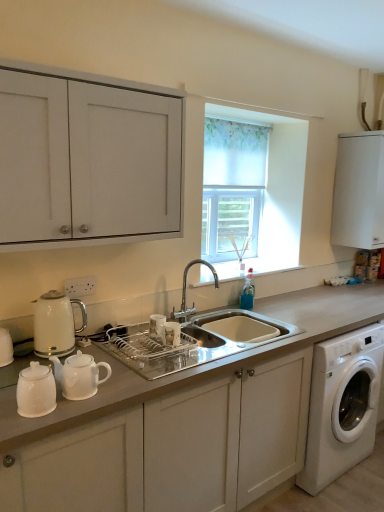
What do you see at coordinates (79, 375) in the screenshot? I see `white glossy teapot at lower left` at bounding box center [79, 375].

Find the location of a particular element. The width and height of the screenshot is (384, 512). blue translucent soap dispenser at sink right is located at coordinates (248, 292).

What do you see at coordinates (359, 191) in the screenshot? The height and width of the screenshot is (512, 384). I see `white matte cabinet at upper right, arranged as the third cabinetry when viewed from the left` at bounding box center [359, 191].

Describe the element at coordinates (87, 159) in the screenshot. I see `white matte cabinet at upper left, which appears as the second cabinetry when ordered from the bottom` at that location.

Describe the element at coordinates (173, 448) in the screenshot. I see `white matte cabinet at center, placed as the 2th cabinetry when sorted from left to right` at that location.

Where is `white glossy teapot at lower left`? white glossy teapot at lower left is located at coordinates (79, 375).

The height and width of the screenshot is (512, 384). What are the coordinates of `cabinetry on the right side of blue translucent soap dispenser at sink right` in the screenshot? It's located at pos(359,191).

Between blue translucent soap dispenser at sink right and white matte cabinet at upper right, which ranks as the first cabinetry in right-to-left order, which one appears on the right side from the viewer's perspective?

Positioned to the right is white matte cabinet at upper right, which ranks as the first cabinetry in right-to-left order.

Looking at the image, does blue translucent soap dispenser at sink right seem bigger or smaller compared to white matte cabinet at upper right, arranged as the third cabinetry when viewed from the left?

In the image, blue translucent soap dispenser at sink right appears to be smaller than white matte cabinet at upper right, arranged as the third cabinetry when viewed from the left.

From the image's perspective, is translucent fabric at center beneath white matte cabinet at center, which appears as the 1th cabinetry when ordered from the bottom?

No.

How different are the orientations of translucent fabric at center and white matte cabinet at center, placed as the third cabinetry when sorted from top to bottom, in degrees?

The angle between the facing direction of translucent fabric at center and the facing direction of white matte cabinet at center, placed as the third cabinetry when sorted from top to bottom, is 0.223 degrees.

Relative to white matte cabinet at center, placed as the third cabinetry when sorted from top to bottom, is translucent fabric at center in front or behind?

Visually, translucent fabric at center is located behind white matte cabinet at center, placed as the third cabinetry when sorted from top to bottom.

Which of these two, polished chrome faucet at center or clear plastic dish at center, is thinner?

Thinner between the two is clear plastic dish at center.

You are a GUI agent. You are given a task and a screenshot of the screen. Output one action in this format:
    pyautogui.click(x=<x>, y=<y>)
    Task: Click on the appliance in front of the polished chrome faucet at center
    This screenshot has width=384, height=512.
    Given the screenshot: What is the action you would take?
    pyautogui.click(x=157, y=325)

Is clear plastic dish at center at the back of polished chrome faucet at center?

polished chrome faucet at center is not turned away from clear plastic dish at center.

Which of these two, polished chrome faucet at center or clear plastic dish at center, is bigger?

Bigger between the two is polished chrome faucet at center.

Looking at this image, is translucent fabric at center surrounded by blue translucent soap dispenser at sink right?

No, blue translucent soap dispenser at sink right does not contain translucent fabric at center.

Find the location of a particular element. The width and height of the screenshot is (384, 512). bottle lying below the translucent fabric at center (from the image's perspective) is located at coordinates (248, 292).

From the image's perspective, is blue translucent soap dispenser at sink right positioned above or below translucent fabric at center?

Based on their image positions, blue translucent soap dispenser at sink right is located beneath translucent fabric at center.

In order to click on window screen above the white glossy teapot at lower left (from the image's perspective) in this screenshot , I will do `click(232, 187)`.

From the picture: Is white glossy teapot at lower left beside translucent fabric at center?

No.

How many degrees apart are the facing directions of white glossy teapot at lower left and translucent fabric at center?

There is a 2.21-degree angle between the facing directions of white glossy teapot at lower left and translucent fabric at center.

Is point (66, 384) closer to viewer compared to point (216, 172)?

Yes, it is.

Looking at this image, who is bigger, white matte cabinet at center, the 2th cabinetry when ordered from right to left, or white plastic washing machine at lower right?

Bigger between the two is white matte cabinet at center, the 2th cabinetry when ordered from right to left.

Could you measure the distance between white matte cabinet at center, placed as the third cabinetry when sorted from top to bottom, and white plastic washing machine at lower right?

white matte cabinet at center, placed as the third cabinetry when sorted from top to bottom, and white plastic washing machine at lower right are 47.14 centimeters apart from each other.

Is white matte cabinet at center, placed as the 2th cabinetry when sorted from left to right, closer to the viewer compared to white plastic washing machine at lower right?

Yes, white matte cabinet at center, placed as the 2th cabinetry when sorted from left to right, is closer to the camera.

Considering the relative sizes of white matte cabinet at center, placed as the 2th cabinetry when sorted from left to right, and white plastic washing machine at lower right in the image provided, is white matte cabinet at center, placed as the 2th cabinetry when sorted from left to right, shorter than white plastic washing machine at lower right?

No, white matte cabinet at center, placed as the 2th cabinetry when sorted from left to right, is not shorter than white plastic washing machine at lower right.

From their relative heights in the image, would you say translucent fabric at center is taller or shorter than white matte cabinet at upper right, acting as the third cabinetry starting from the bottom?

translucent fabric at center is taller than white matte cabinet at upper right, acting as the third cabinetry starting from the bottom.

Is translucent fabric at center surrounding white matte cabinet at upper right, which appears as the first cabinetry when viewed from the top?

No, translucent fabric at center does not contain white matte cabinet at upper right, which appears as the first cabinetry when viewed from the top.

Is translucent fabric at center far away from white matte cabinet at upper right, which appears as the first cabinetry when viewed from the top?

They are positioned close to each other.

Which is behind, translucent fabric at center or white matte cabinet at upper right, arranged as the third cabinetry when viewed from the left?

→ white matte cabinet at upper right, arranged as the third cabinetry when viewed from the left.

Image resolution: width=384 pixels, height=512 pixels. What are the coordinates of `bottle below the white matte cabinet at upper right, acting as the third cabinetry starting from the bottom (from the image's perspective)` in the screenshot? It's located at (248, 292).

Where is `window screen on the right of white matte cabinet at center, which appears as the 1th cabinetry when ordered from the bottom`? The width and height of the screenshot is (384, 512). window screen on the right of white matte cabinet at center, which appears as the 1th cabinetry when ordered from the bottom is located at coordinates (232, 187).

When comparing their distances from polished chrome faucet at center, does clear plastic dish at center or translucent fabric at center seem further?

Based on the image, translucent fabric at center appears to be further to polished chrome faucet at center.

Which object lies further to the anchor point blue translucent soap dispenser at sink right, translucent fabric at center or white plastic washing machine at lower right?

white plastic washing machine at lower right.

Which object lies further to the anchor point blue translucent soap dispenser at sink right, white glossy teapot at lower left or white matte cabinet at center, the 2th cabinetry when ordered from right to left?

Among the two, white glossy teapot at lower left is located further to blue translucent soap dispenser at sink right.

Considering their positions, is clear plastic dish at center positioned closer to white matte cabinet at upper right, acting as the third cabinetry starting from the bottom, than white glossy electric kettle at left?

Based on the image, clear plastic dish at center appears to be nearer to white matte cabinet at upper right, acting as the third cabinetry starting from the bottom.

Considering their positions, is translucent fabric at center positioned closer to white glossy electric kettle at left than white matte cabinet at center, placed as the 2th cabinetry when sorted from left to right?

Among the two, white matte cabinet at center, placed as the 2th cabinetry when sorted from left to right, is located nearer to white glossy electric kettle at left.

Which object lies nearer to the anchor point clear plastic dish at center, blue translucent soap dispenser at sink right or white glossy electric kettle at left?

white glossy electric kettle at left is closer to clear plastic dish at center.

Estimate the real-world distances between objects in this image. Which object is closer to white matte cabinet at upper right, which appears as the first cabinetry when viewed from the top, white plastic washing machine at lower right or white matte cabinet at upper left, which appears as the second cabinetry when ordered from the bottom?

white plastic washing machine at lower right is closer to white matte cabinet at upper right, which appears as the first cabinetry when viewed from the top.

From the image, which object appears to be farther from clear plastic dish at center, white matte cabinet at center, placed as the 2th cabinetry when sorted from left to right, or white matte cabinet at upper left, placed as the third cabinetry when sorted from right to left?

white matte cabinet at upper left, placed as the third cabinetry when sorted from right to left.

Image resolution: width=384 pixels, height=512 pixels. What are the coordinates of `coffeepot between white matte cabinet at center, the 2th cabinetry when ordered from right to left, and clear plastic dish at center in the front-back direction` in the screenshot? It's located at (56, 324).

Find the location of `tea pot located between white glossy electric kettle at left and white matte cabinet at upper right, which ranks as the first cabinetry in right-to-left order, in the left-right direction`. tea pot located between white glossy electric kettle at left and white matte cabinet at upper right, which ranks as the first cabinetry in right-to-left order, in the left-right direction is located at coordinates [x=79, y=375].

You are a GUI agent. You are given a task and a screenshot of the screen. Output one action in this format:
    pyautogui.click(x=<x>, y=<y>)
    Task: Click on the tap that lies between translucent fabric at center and clear plastic dish at center from top to bottom
    This screenshot has width=384, height=512.
    Given the screenshot: What is the action you would take?
    pyautogui.click(x=185, y=292)

You are a GUI agent. You are given a task and a screenshot of the screen. Output one action in this format:
    pyautogui.click(x=<x>, y=<y>)
    Task: Click on the tea pot located between white glossy electric kettle at left and white plastic washing machine at lower right in the left-right direction
    This screenshot has width=384, height=512.
    Given the screenshot: What is the action you would take?
    [79, 375]